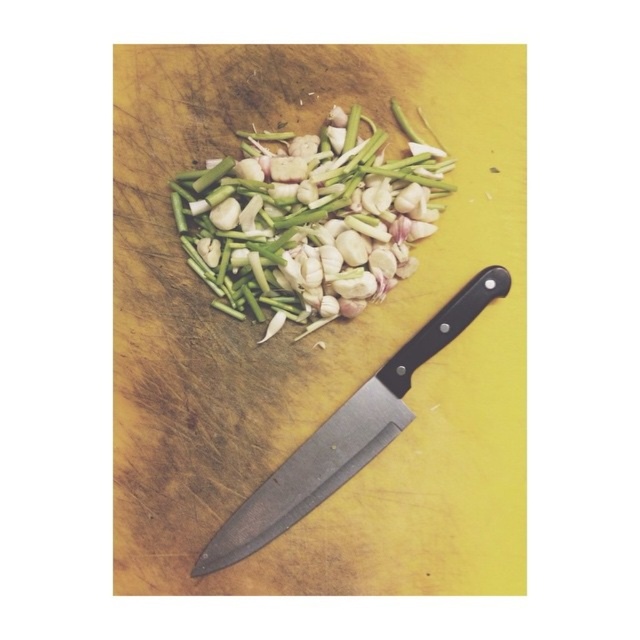
Question: Does green matte garlic at center have a smaller size compared to black matte knife at lower right?

Choices:
 (A) no
 (B) yes

Answer: (B)

Question: Considering the relative positions of green matte garlic at center and black matte knife at lower right in the image provided, where is green matte garlic at center located with respect to black matte knife at lower right?

Choices:
 (A) left
 (B) right

Answer: (A)

Question: In this image, where is wooden cutting board at center located relative to green matte garlic at center?

Choices:
 (A) below
 (B) above

Answer: (A)

Question: Considering the real-world distances, which object is farthest from the black matte knife at lower right?

Choices:
 (A) green matte garlic at center
 (B) wooden cutting board at center

Answer: (A)

Question: Which is nearer to the wooden cutting board at center?

Choices:
 (A) black matte knife at lower right
 (B) green matte garlic at center

Answer: (B)

Question: Which object appears closest to the camera in this image?

Choices:
 (A) wooden cutting board at center
 (B) green matte garlic at center
 (C) black matte knife at lower right

Answer: (A)